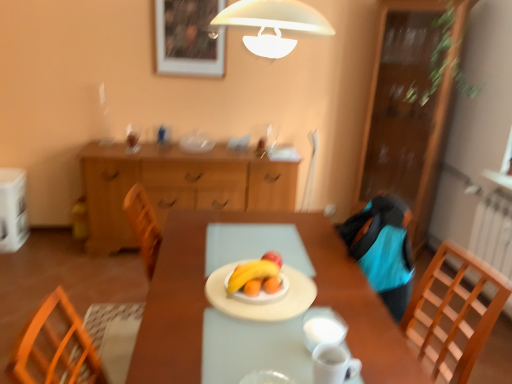
Locate an element on the screen. vacant area to the right of shiny red apple at center is located at coordinates (311, 271).